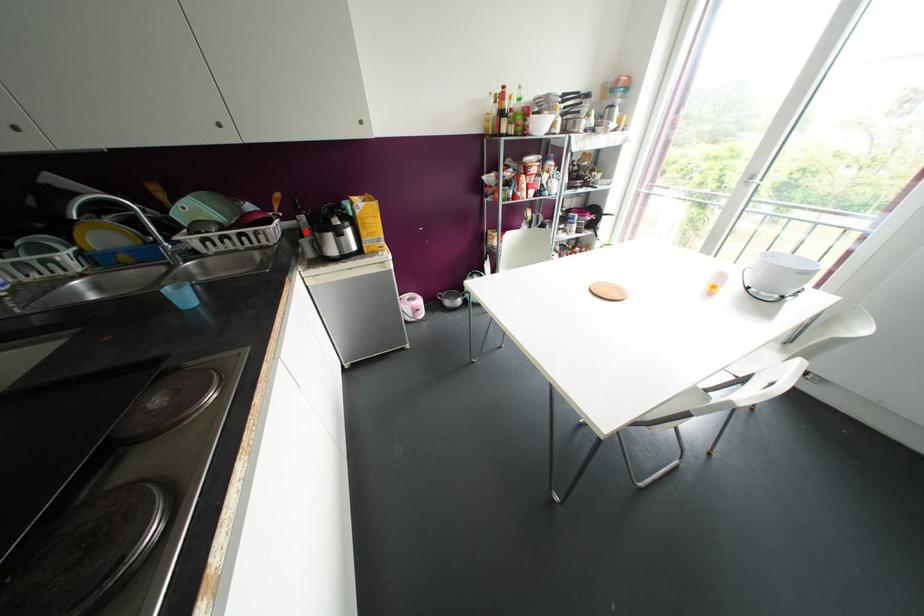
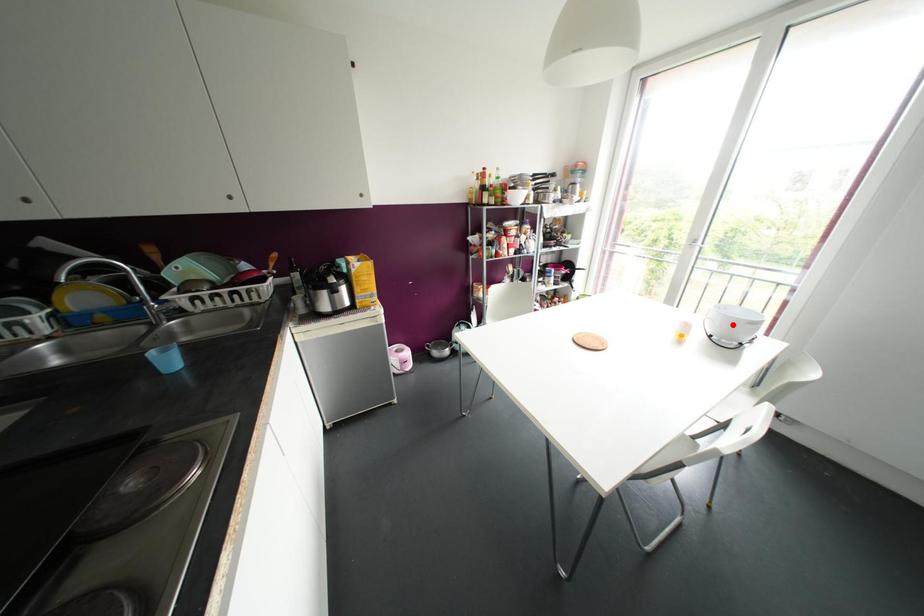
I am providing you with two images of the same scene from different viewpoints. A red point is marked on the first image and another point is marked on the second image. Does the point marked in image1 correspond to the same location as the one in image2?

No